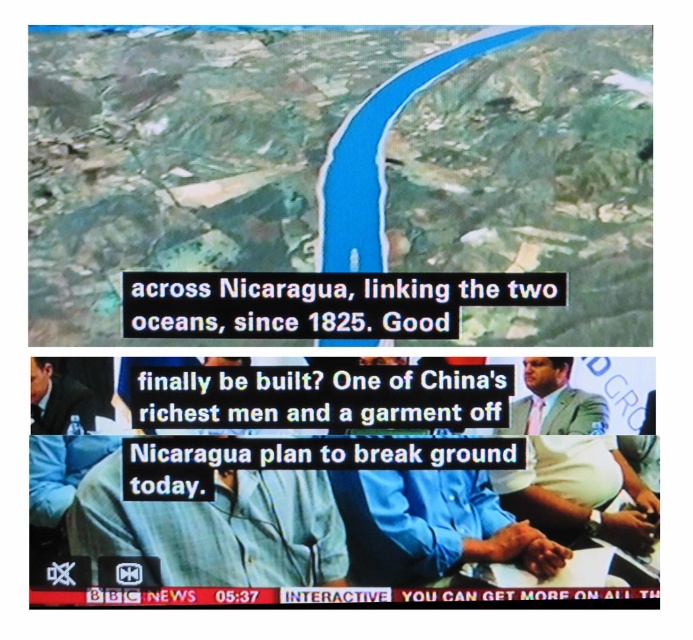
From the picture: You are a news anchor wearing a light blue shirt at left and standing next to a colleague in a light blue suit at right. Your teleprompter mentions the canal has been in use since 1825. Where should you look to ensure your colleague is visible in the frame?

The light blue suit at right is located below the light blue shirt at left, so you should look downward to ensure your colleague in the light blue suit at right is visible in the frame.

You are a fashion designer analyzing a news broadcast image. You notice two people wearing light blue clothing. The person in the light blue suit at right and the person in the light blue shirt at left. Which clothing item takes up more space in the image?

The light blue suit at right is bigger than the light blue shirt at left, so the suit takes up more space in the image.

You are a fashion designer observing a news broadcast. You notice two items of clothing on the screen, the light blue suit at right and the light blue shirt at left. Which clothing item appears taller in the image?

The light blue suit at right appears taller than the light blue shirt at left in the image.